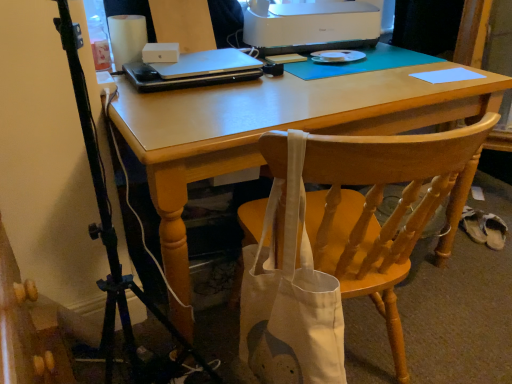
The width and height of the screenshot is (512, 384). Identify the location of free space in front of white plastic printer at upper center. (347, 79).